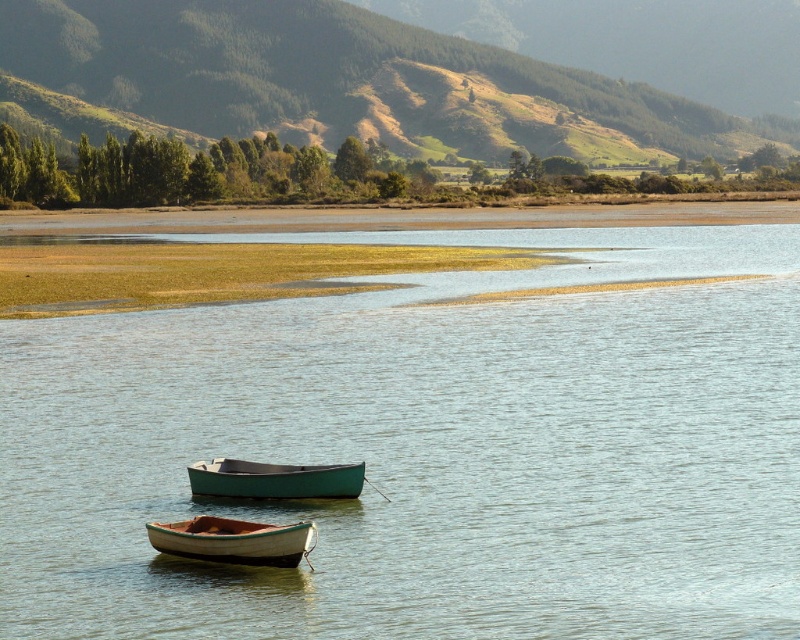
Question: Which object is farther from the camera taking this photo?

Choices:
 (A) green wood boats at center
 (B) green matte canoe at center
 (C) green grassy hillside at upper center
 (D) wooden canoe at lower center

Answer: (C)

Question: Observing the image, what is the correct spatial positioning of green grassy hillside at upper center in reference to wooden canoe at lower center?

Choices:
 (A) above
 (B) below

Answer: (A)

Question: Is wooden canoe at lower center positioned behind green matte canoe at center?

Choices:
 (A) no
 (B) yes

Answer: (A)

Question: Does green grassy hillside at upper center have a smaller size compared to wooden canoe at lower center?

Choices:
 (A) no
 (B) yes

Answer: (A)

Question: Which object appears closest to the camera in this image?

Choices:
 (A) wooden canoe at lower center
 (B) green grassy hillside at upper center
 (C) green matte canoe at center

Answer: (A)

Question: Which object appears farthest from the camera in this image?

Choices:
 (A) green grassy hillside at upper center
 (B) wooden canoe at lower center
 (C) green matte canoe at center

Answer: (A)